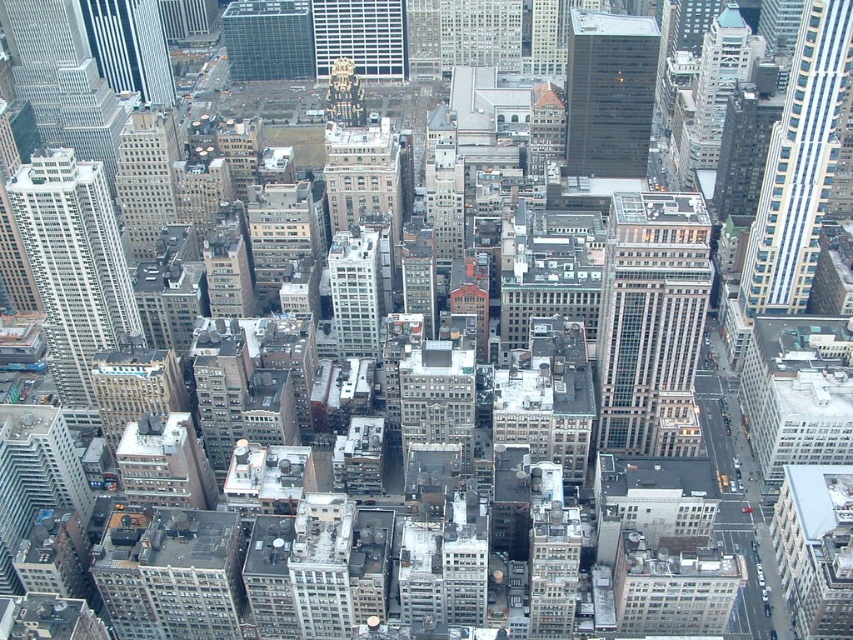
Question: Which of the following is the closest to the observer?

Choices:
 (A) white glass building at left
 (B) white smooth building at center
 (C) white glass skyscraper at center
 (D) dark glass skyscraper at center

Answer: (B)

Question: Which object is positioned closest to the white glass building at left?

Choices:
 (A) glassy steel skyscraper at center
 (B) clear glass skyscraper at upper center

Answer: (B)

Question: Considering the real-world distances, which object is farthest from the glassy steel skyscraper at center?

Choices:
 (A) white glass skyscraper at center
 (B) dark glass skyscraper at center
 (C) white smooth building at center

Answer: (A)

Question: Does glassy steel skyscraper at upper right appear over clear glass skyscraper at upper center?

Choices:
 (A) yes
 (B) no

Answer: (B)

Question: Does glassy steel skyscraper at center appear over white smooth building at center?

Choices:
 (A) no
 (B) yes

Answer: (A)

Question: Can you confirm if glassy steel skyscraper at center is bigger than white glass building at left?

Choices:
 (A) no
 (B) yes

Answer: (A)